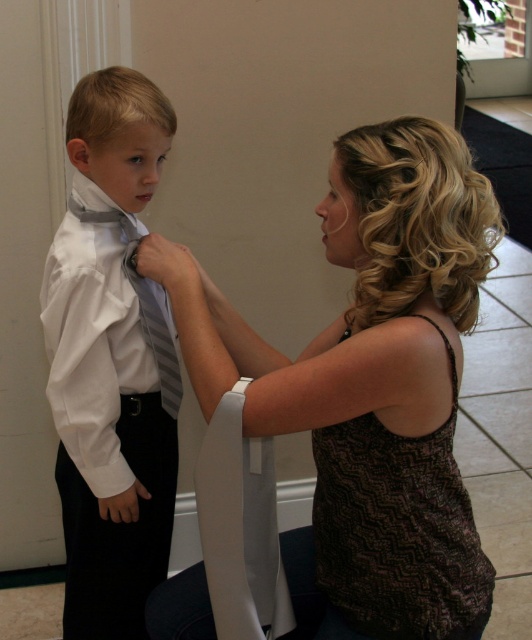
Question: Is matte gray tie at left smaller than brown zigzag-patterned tank top at center?

Choices:
 (A) no
 (B) yes

Answer: (A)

Question: Does matte brown tank top at center appear on the left side of striped fabric tie at center?

Choices:
 (A) yes
 (B) no

Answer: (B)

Question: Which of these objects is positioned farthest from the striped fabric tie at center?

Choices:
 (A) brown zigzag-patterned tank top at center
 (B) matte gray tie at left
 (C) matte brown tank top at center

Answer: (A)

Question: Which point appears closest to the camera in this image?

Choices:
 (A) (189, 298)
 (B) (165, 349)
 (C) (45, 333)

Answer: (A)

Question: Is matte brown tank top at center thinner than brown zigzag-patterned tank top at center?

Choices:
 (A) yes
 (B) no

Answer: (B)

Question: Which object appears closest to the camera in this image?

Choices:
 (A) brown zigzag-patterned tank top at center
 (B) matte gray tie at left
 (C) striped fabric tie at center
 (D) matte brown tank top at center

Answer: (D)